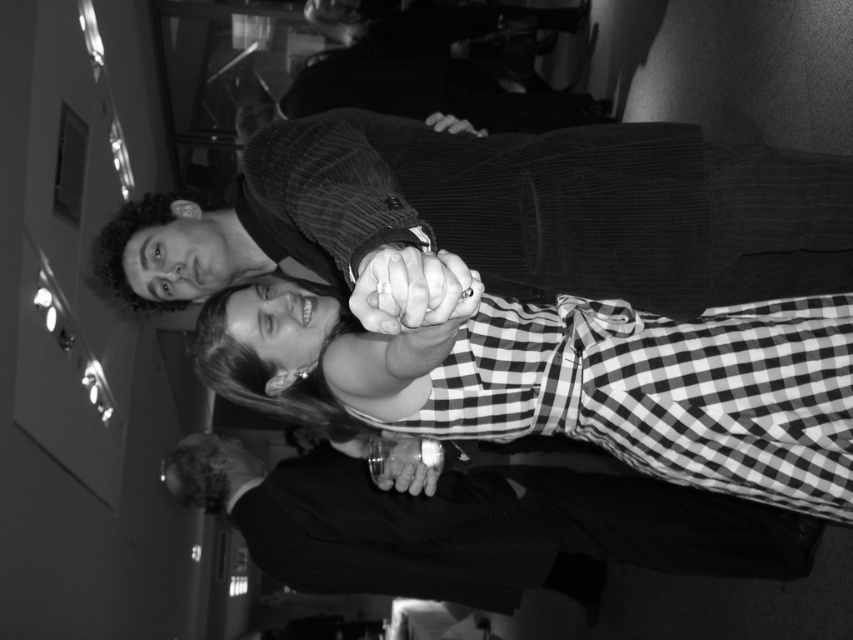
Is corduroy suit at center taller than smooth black ring at center?

Indeed, corduroy suit at center has a greater height compared to smooth black ring at center.

Where is `corduroy suit at center`? The height and width of the screenshot is (640, 853). corduroy suit at center is located at coordinates (556, 205).

At what (x,y) coordinates should I click in order to perform the action: click on corduroy suit at center. Please return your answer as a coordinate pair (x, y). Looking at the image, I should click on (556, 205).

Who is shorter, smooth black suit at lower center or white matte spiral at center?

Standing shorter between the two is white matte spiral at center.

Which of these two, smooth black suit at lower center or white matte spiral at center, stands taller?

With more height is smooth black suit at lower center.

The image size is (853, 640). In order to click on smooth black suit at lower center in this screenshot , I will do `click(477, 525)`.

This screenshot has width=853, height=640. In order to click on smooth black suit at lower center in this screenshot , I will do `click(477, 525)`.

Is corduroy suit at center positioned at the back of checkered fabric dress at center?

Yes, corduroy suit at center is behind checkered fabric dress at center.

Identify the location of corduroy suit at center. (556, 205).